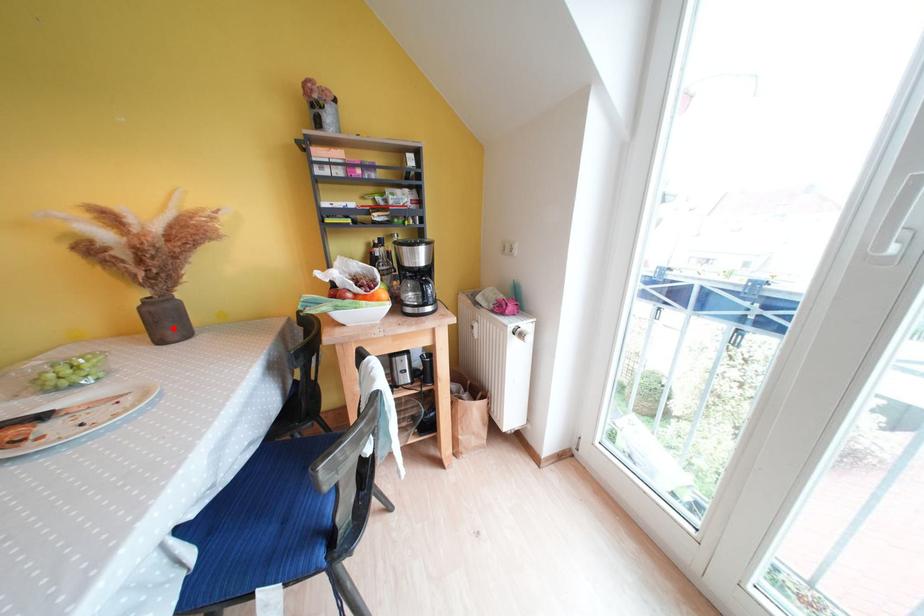
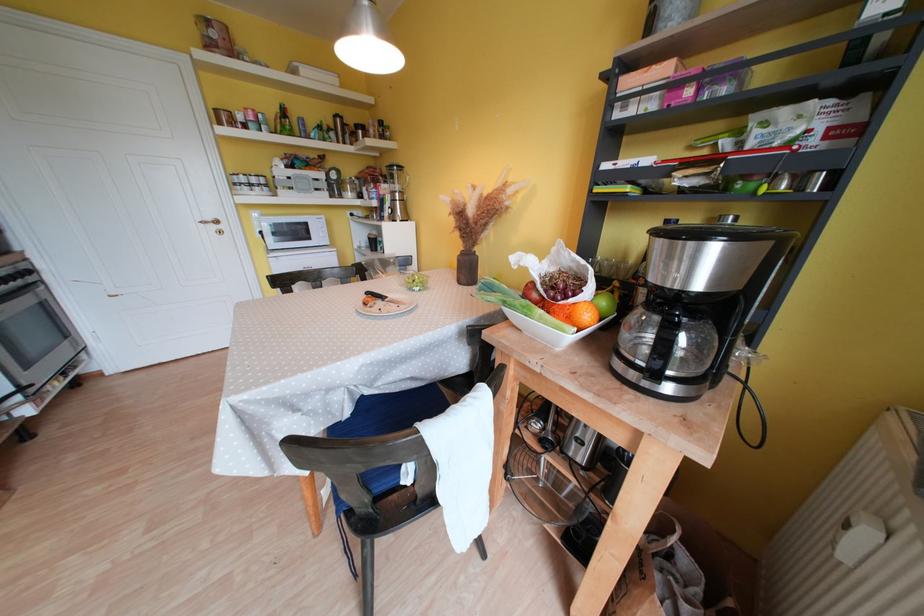
Find the pixel in the second image that matches the highlighted location in the first image.

(472, 275)